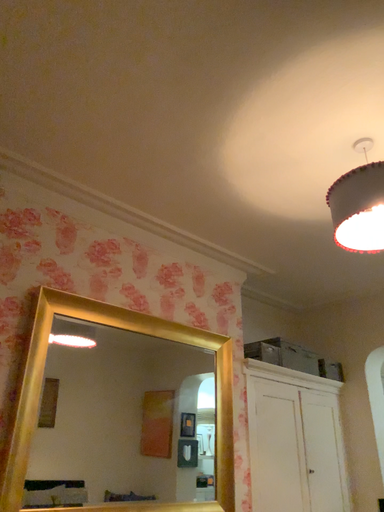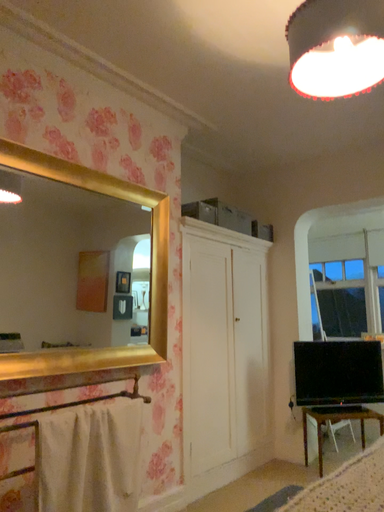
Question: Which way did the camera rotate in the video?

Choices:
 (A) rotated left
 (B) rotated right

Answer: (B)